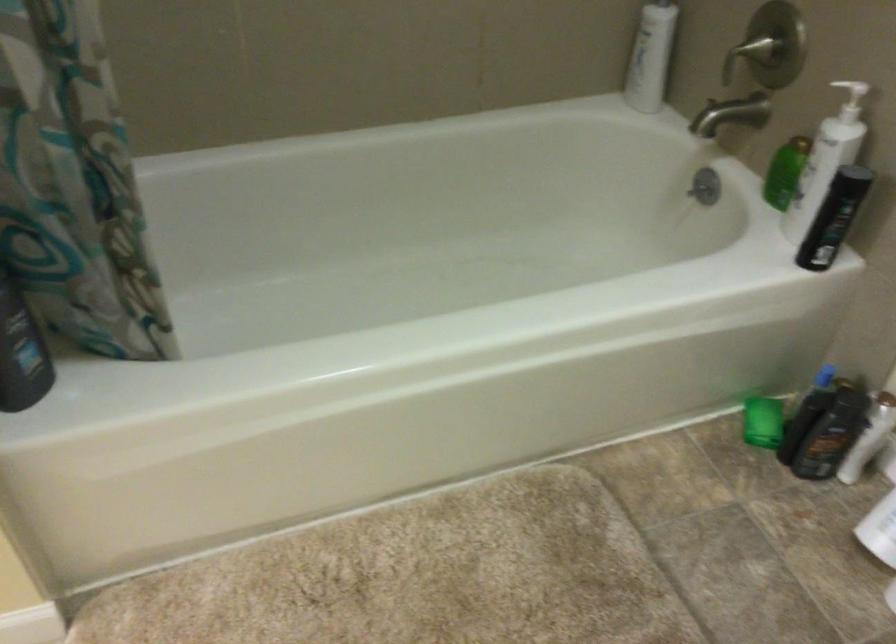
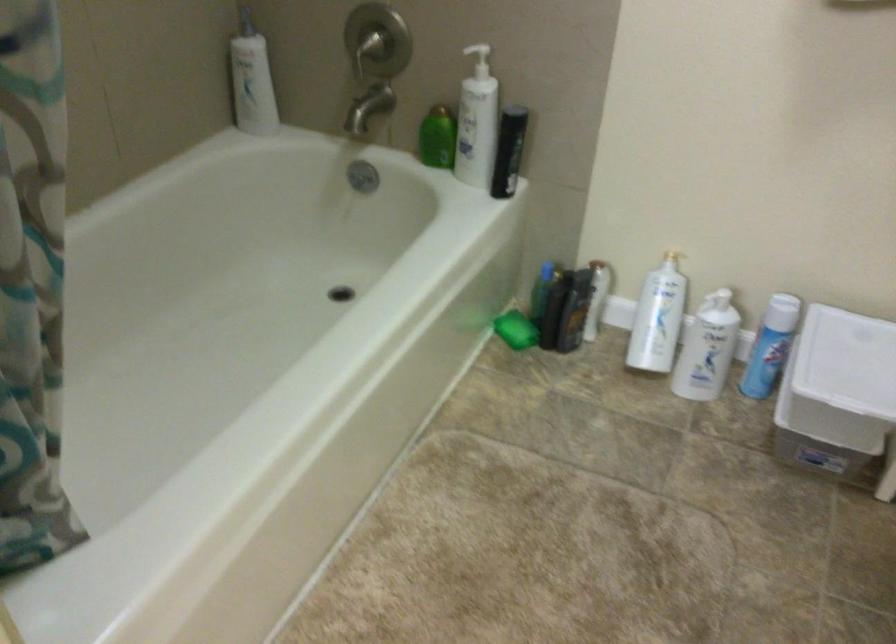
In the second image, find the point that corresponds to (778,174) in the first image.

(437, 138)